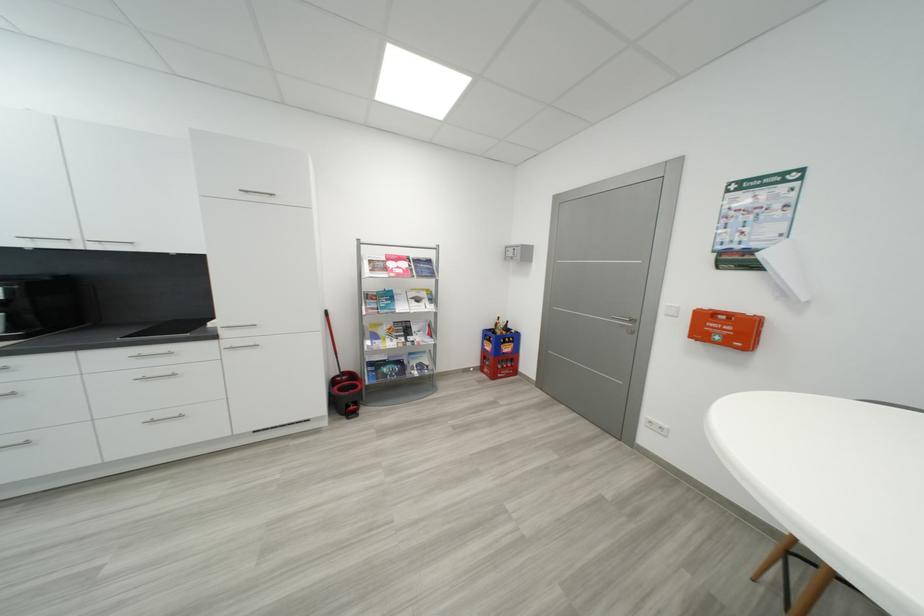
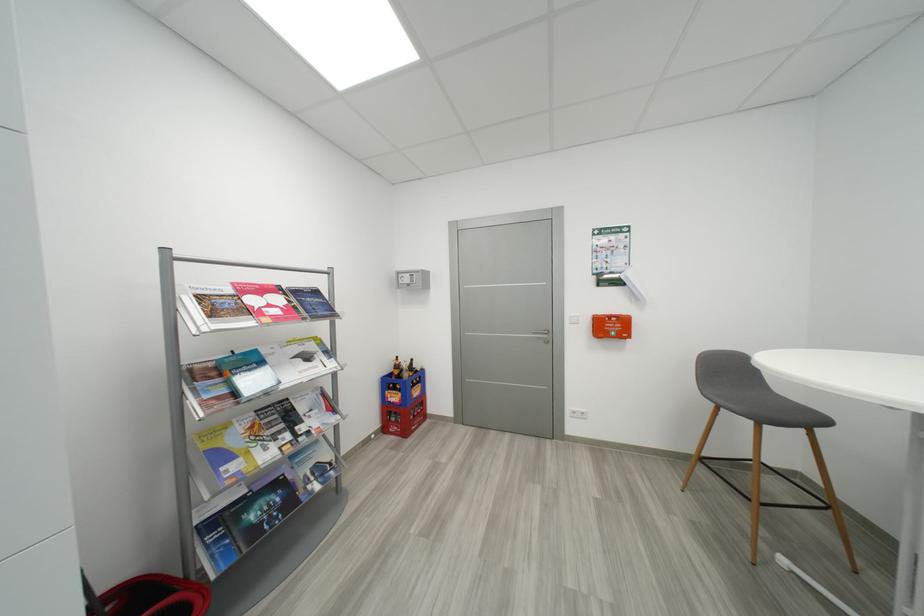
Where in the second image is the point corresponding to (407,363) from the first image?

(285, 485)